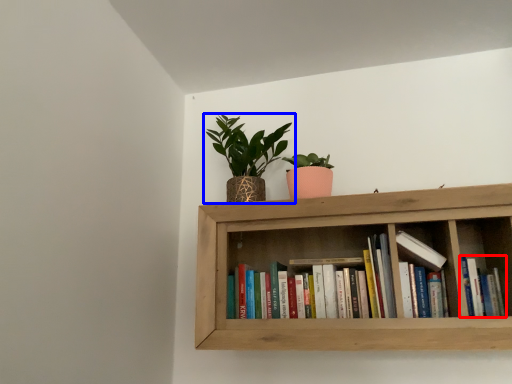
Question: Which object appears farthest to the camera in this image, book (highlighted by a red box) or houseplant (highlighted by a blue box)?

Choices:
 (A) book
 (B) houseplant

Answer: (B)